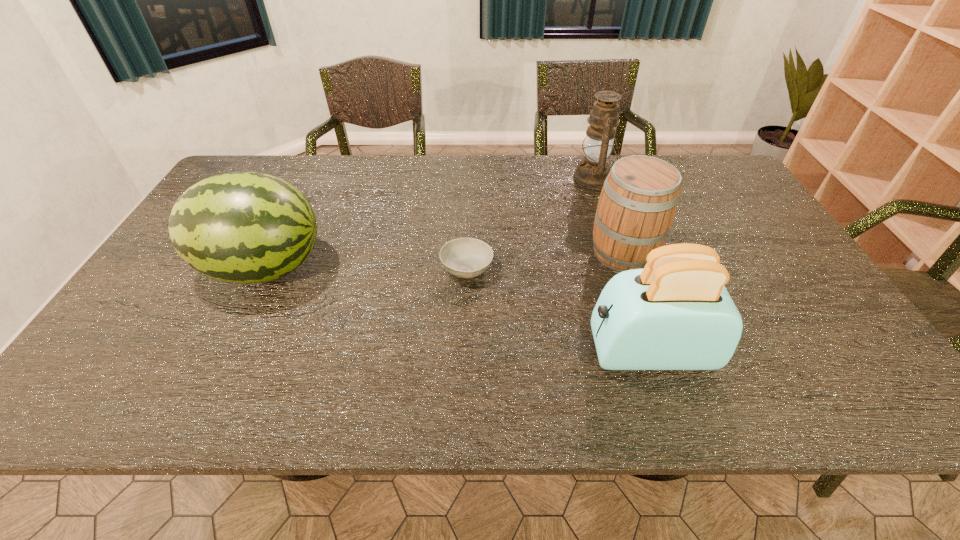
In order to click on free region that satisfies the following two spatial constraints: 1. on the front side of the cider; 2. on the side of the toaster with the lever in this screenshot , I will do `click(657, 351)`.